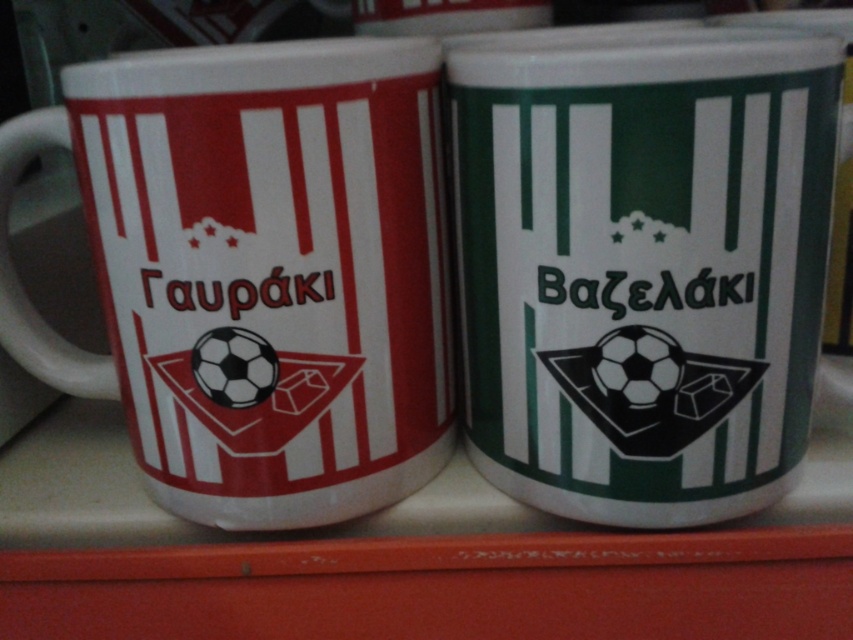
You are organizing a shelf and need to place a new mug between the green matte mug at center and the matte white mug at left. Based on their current positions, where should the new mug be placed?

The green matte mug at center is located above the matte white mug at left, so the new mug should be placed between them either above or below depending on desired arrangement. However, since the green is already above the white one, placing it in between would require positioning it either above the white one but below the green one or below the green one but above the white one. But given their vertical arrangement, the most logical placement would be between them vertically. However, without knowing the

You are looking at a shelf with two mugs. There is a point marked at coordinates (643,266). Which mug does this point correspond to?

The point at coordinates (643,266) corresponds to the green matte mug at center.